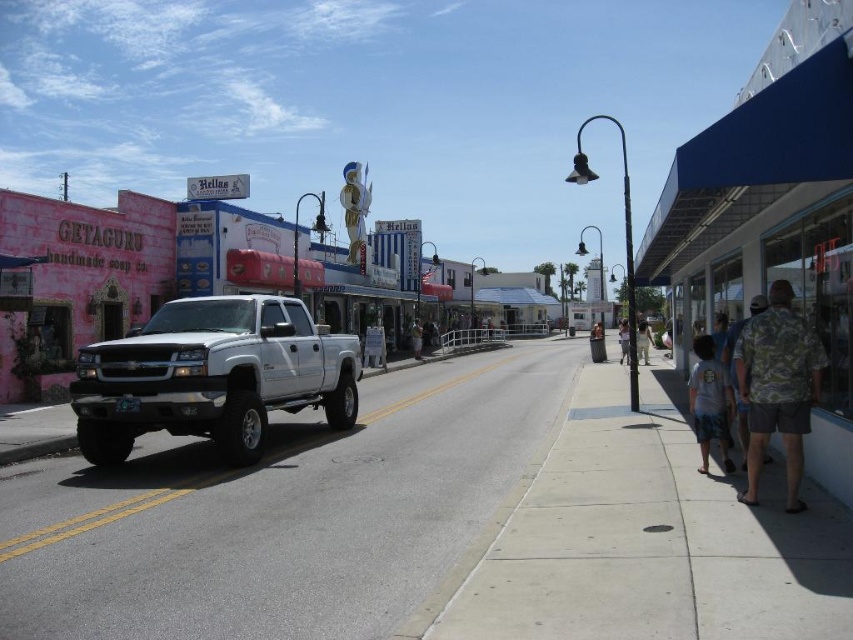
Question: Which point appears closest to the camera in this image?

Choices:
 (A) (622, 356)
 (B) (738, 417)
 (C) (643, 349)

Answer: (B)

Question: Which object is farther from the camera taking this photo?

Choices:
 (A) concrete sidewalk at lower right
 (B) brown fabric shirt at center
 (C) white cotton shirt at center
 (D) camouflage shirt at right

Answer: (B)

Question: Observing the image, what is the correct spatial positioning of camouflage fabric shirt at right in reference to camouflage shirt at center?

Choices:
 (A) above
 (B) below

Answer: (B)

Question: Which object is closer to the camera taking this photo?

Choices:
 (A) camouflage fabric shirt at right
 (B) white metallic truck at center
 (C) gray asphalt road at center
 (D) camouflage shirt at right

Answer: (C)

Question: Is concrete sidewalk at lower right to the right of brown fabric shirt at center from the viewer's perspective?

Choices:
 (A) no
 (B) yes

Answer: (B)

Question: Does gray asphalt road at center appear on the left side of white cotton shirt at lower right?

Choices:
 (A) no
 (B) yes

Answer: (B)